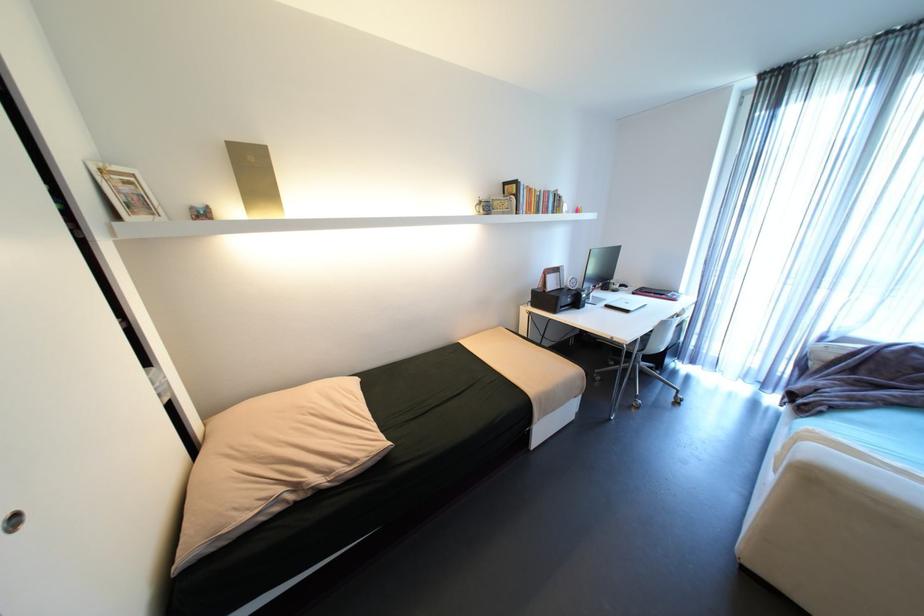
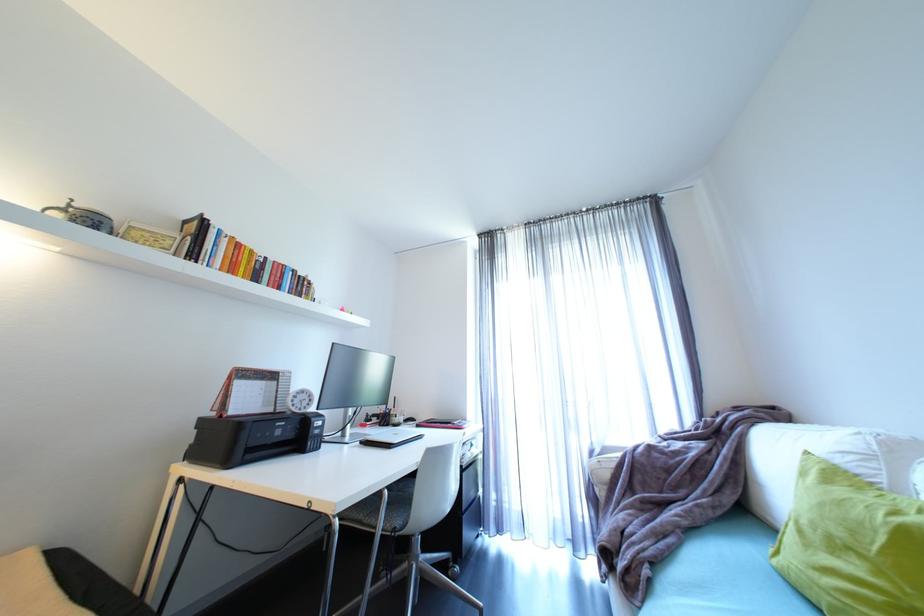
Locate, in the second image, the point that corresponds to the point at 830,408 in the first image.

(653, 572)